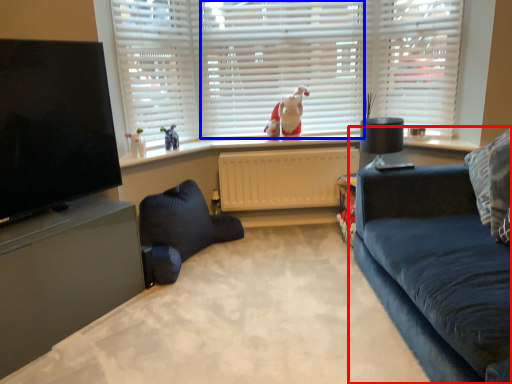
Question: Which object appears closest to the camera in this image, studio couch (highlighted by a red box) or shutter (highlighted by a blue box)?

Choices:
 (A) studio couch
 (B) shutter

Answer: (A)